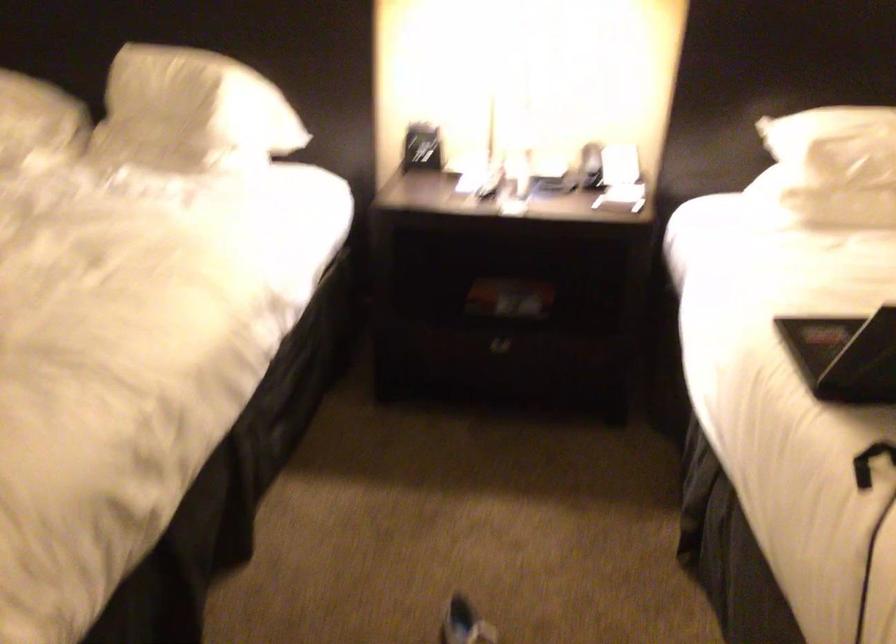
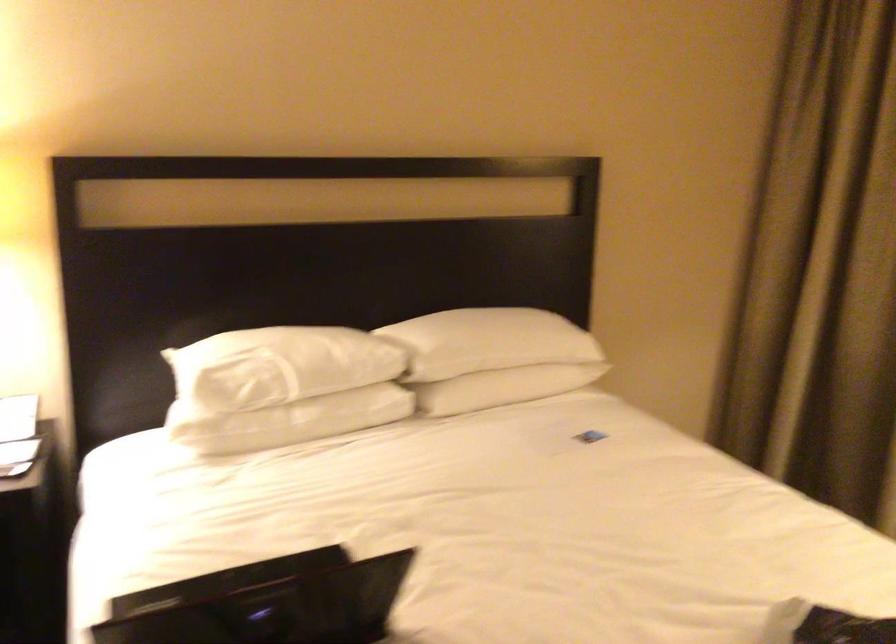
Question: The first image is from the beginning of the video and the second image is from the end. How did the camera likely rotate when shooting the video?

Choices:
 (A) Left
 (B) Right
 (C) Up
 (D) Down

Answer: (B)